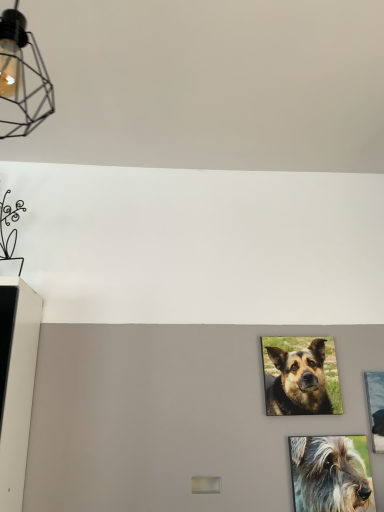
Question: In terms of height, does metallic silver picture frame at right look taller or shorter compared to shaggy gray dog at lower right, which is the 1th dog in front-to-back order?

Choices:
 (A) tall
 (B) short

Answer: (A)

Question: Is metallic silver picture frame at right inside or outside of shaggy gray dog at lower right, which is counted as the 1th dog, starting from the bottom?

Choices:
 (A) inside
 (B) outside

Answer: (B)

Question: Based on their relative distances, which object is nearer to the matte black wireframe light fixture at upper left?

Choices:
 (A) shaggy gray dog at lower right, which is counted as the 1th dog, starting from the bottom
 (B) brown fur dog at center, which is the second dog from front to back
 (C) metallic silver picture frame at right

Answer: (B)

Question: Which is farther from the shaggy gray dog at lower right, which is the second dog from top to bottom?

Choices:
 (A) metallic silver picture frame at right
 (B) matte black wireframe light fixture at upper left
 (C) brown fur dog at center, which is the second dog from front to back

Answer: (B)